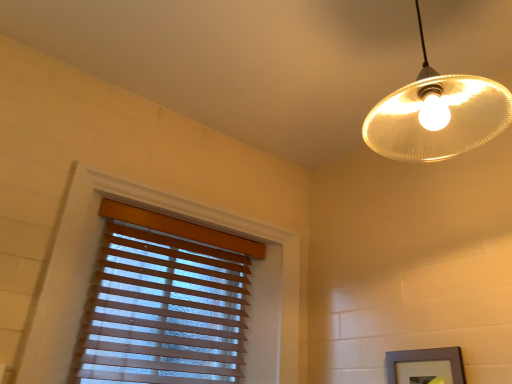
Question: Does point (475, 109) appear closer or farther from the camera than point (454, 350)?

Choices:
 (A) farther
 (B) closer

Answer: (B)

Question: In the image, is translucent glass lampshade at upper right positioned in front of or behind gray matte picture frame at lower right?

Choices:
 (A) front
 (B) behind

Answer: (A)

Question: Estimate the real-world distances between objects in this image. Which object is closer to the gray matte picture frame at lower right?

Choices:
 (A) translucent glass lampshade at upper right
 (B) wooden blinds at left

Answer: (A)

Question: Considering the real-world distances, which object is farthest from the gray matte picture frame at lower right?

Choices:
 (A) translucent glass lampshade at upper right
 (B) wooden blinds at left

Answer: (B)